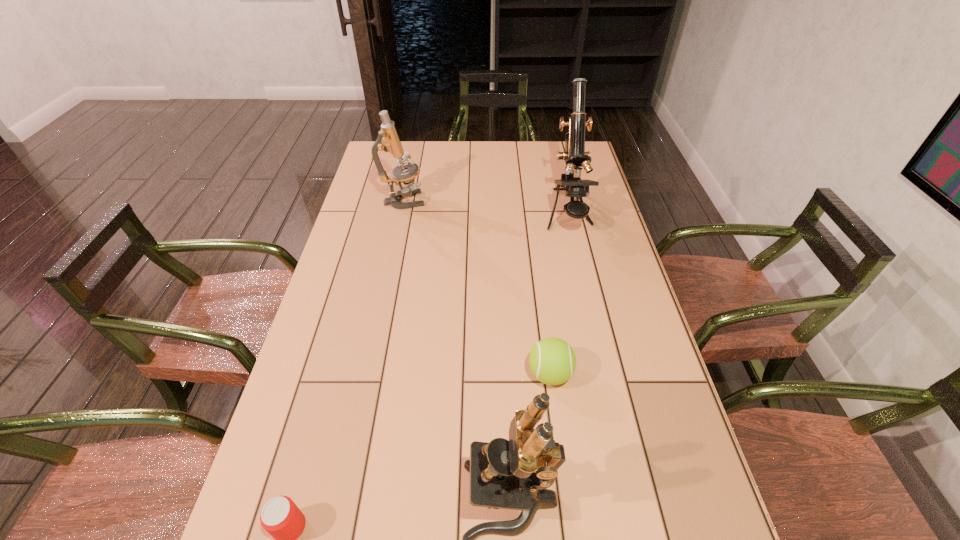
Find the location of a particular element. microscope that stands as the second closest to the rightmost microscope is located at coordinates (514, 474).

The height and width of the screenshot is (540, 960). I want to click on vacant space that satisfies the following two spatial constraints: 1. on the front side of the leftmost microscope; 2. on the left side of the fourth tallest object, so click(367, 374).

The width and height of the screenshot is (960, 540). I want to click on free spot that satisfies the following two spatial constraints: 1. on the front side of the third farthest object; 2. on the right side of the leftmost microscope, so click(367, 374).